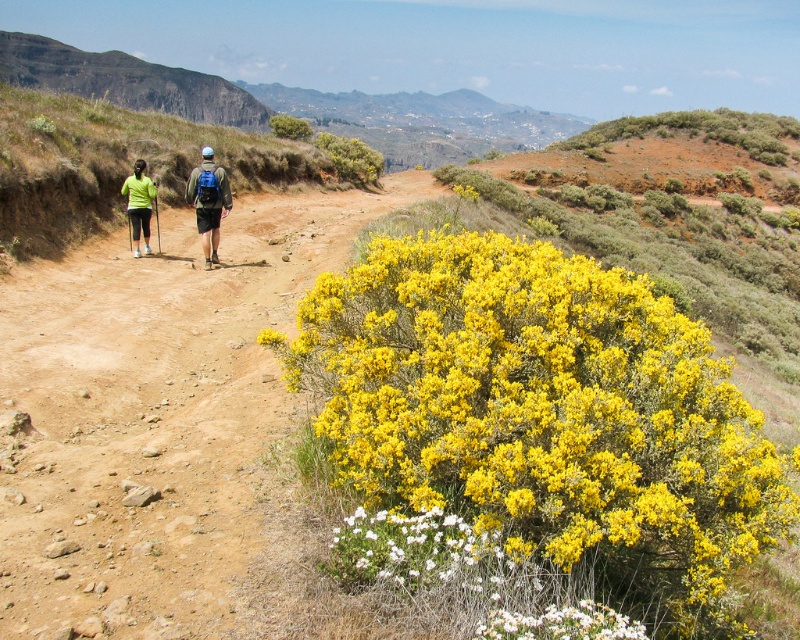
This screenshot has width=800, height=640. What do you see at coordinates (208, 202) in the screenshot? I see `green fabric shirt at upper left` at bounding box center [208, 202].

Between green fabric shirt at upper left and yellow shrub at upper center, which one has less height?

With less height is green fabric shirt at upper left.

Is point (154, 189) positioned before point (272, 116)?

That is True.

Identify the location of green fabric shirt at upper left. The height and width of the screenshot is (640, 800). (208, 202).

Which is more to the right, rugged rock cliff at upper left or matte blue backpack at center?

Positioned to the right is matte blue backpack at center.

Does rugged rock cliff at upper left lie in front of matte blue backpack at center?

No, rugged rock cliff at upper left is further to the viewer.

Measure the distance between rugged rock cliff at upper left and camera.

rugged rock cliff at upper left is 85.08 meters away from camera.

In order to click on rugged rock cliff at upper left in this screenshot , I will do `click(126, 81)`.

Can you confirm if yellow bush at right is positioned below matte black shorts at left?

Indeed, yellow bush at right is positioned under matte black shorts at left.

Does yellow bush at right have a greater height compared to matte black shorts at left?

Indeed, yellow bush at right has a greater height compared to matte black shorts at left.

Does point (356, 433) come closer to viewer compared to point (146, 237)?

That is True.

I want to click on yellow bush at right, so click(544, 417).